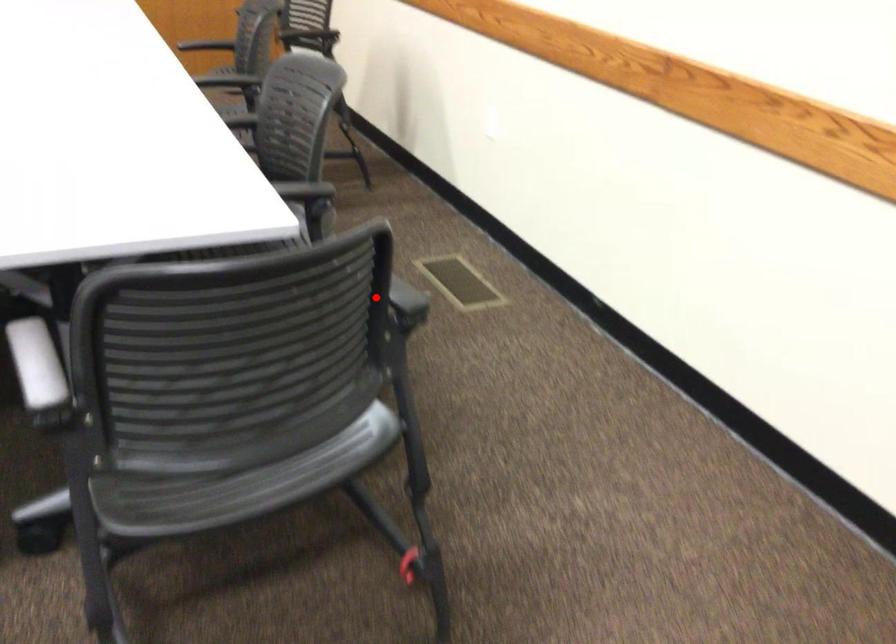
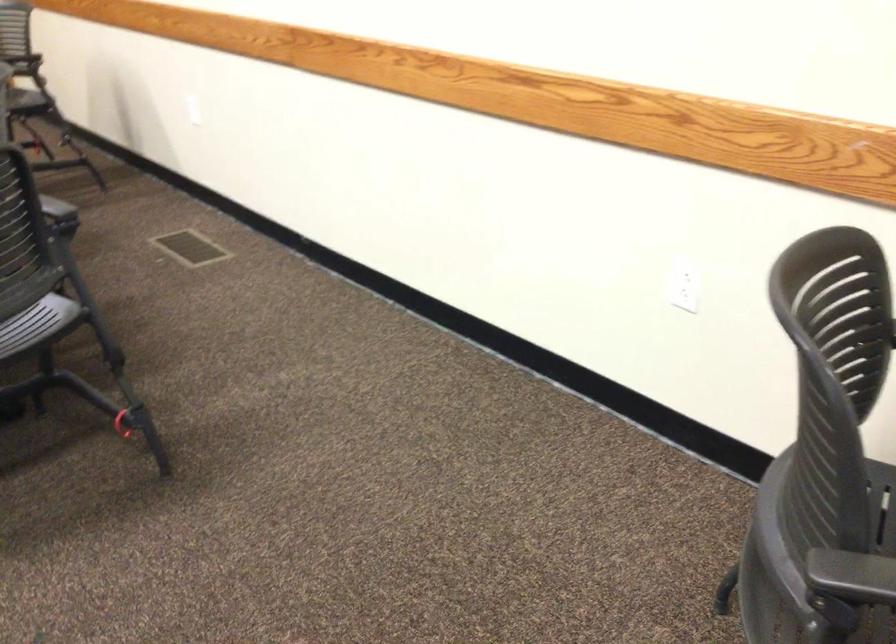
Question: I am providing you with two images of the same scene from different viewpoints. Given a red point in image1, look at the same physical point in image2. Is it:

Choices:
 (A) Closer to the viewpoint
 (B) Farther from the viewpoint

Answer: (B)